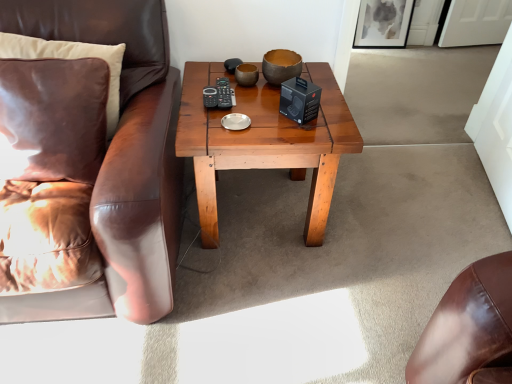
Question: Does suede pillow at left, which ranks as the 2th pillow in front-to-back order, have a lesser width compared to velvet brown pillow at left, arranged as the 1th pillow when viewed from the front?

Choices:
 (A) yes
 (B) no

Answer: (A)

Question: Is suede pillow at left, which ranks as the 2th pillow in front-to-back order, at the left side of velvet brown pillow at left, which ranks as the second pillow in back-to-front order?

Choices:
 (A) no
 (B) yes

Answer: (B)

Question: From the image's perspective, is suede pillow at left, which ranks as the 2th pillow in front-to-back order, located beneath velvet brown pillow at left, which ranks as the second pillow in back-to-front order?

Choices:
 (A) yes
 (B) no

Answer: (B)

Question: Is suede pillow at left, marked as the 1th pillow in a back-to-front arrangement, turned away from velvet brown pillow at left, which ranks as the second pillow in back-to-front order?

Choices:
 (A) no
 (B) yes

Answer: (B)

Question: Is suede pillow at left, marked as the 1th pillow in a back-to-front arrangement, not close to velvet brown pillow at left, arranged as the 1th pillow when viewed from the front?

Choices:
 (A) yes
 (B) no

Answer: (B)

Question: Is suede pillow at left, which ranks as the 2th pillow in front-to-back order, placed right next to velvet brown pillow at left, arranged as the 1th pillow when viewed from the front?

Choices:
 (A) no
 (B) yes

Answer: (A)

Question: Is matte brown bowl at center to the left of velvet brown pillow at left, which ranks as the second pillow in back-to-front order, from the viewer's perspective?

Choices:
 (A) yes
 (B) no

Answer: (B)

Question: Is matte brown bowl at center oriented away from velvet brown pillow at left, arranged as the 1th pillow when viewed from the front?

Choices:
 (A) yes
 (B) no

Answer: (B)

Question: Considering the relative positions of matte brown bowl at center and velvet brown pillow at left, arranged as the 1th pillow when viewed from the front, in the image provided, is matte brown bowl at center to the right of velvet brown pillow at left, arranged as the 1th pillow when viewed from the front, from the viewer's perspective?

Choices:
 (A) no
 (B) yes

Answer: (B)

Question: Can you confirm if matte brown bowl at center is shorter than velvet brown pillow at left, which ranks as the second pillow in back-to-front order?

Choices:
 (A) yes
 (B) no

Answer: (A)

Question: From a real-world perspective, is matte brown bowl at center on velvet brown pillow at left, arranged as the 1th pillow when viewed from the front?

Choices:
 (A) yes
 (B) no

Answer: (A)

Question: Is matte brown bowl at center facing towards velvet brown pillow at left, which ranks as the second pillow in back-to-front order?

Choices:
 (A) no
 (B) yes

Answer: (A)

Question: Is velvet brown pillow at left, which ranks as the second pillow in back-to-front order, not inside wooden coffee table at center?

Choices:
 (A) no
 (B) yes

Answer: (B)